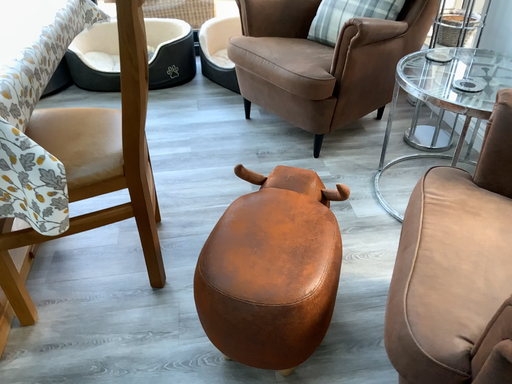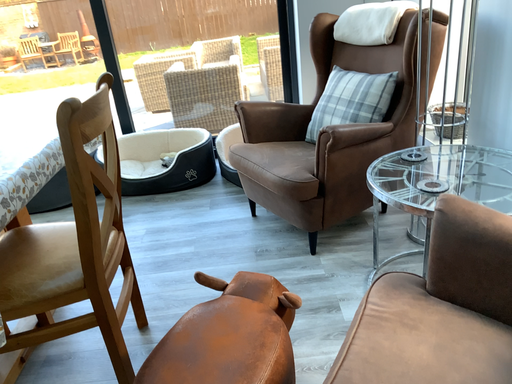
Question: How did the camera likely rotate when shooting the video?

Choices:
 (A) rotated upward
 (B) rotated downward

Answer: (A)